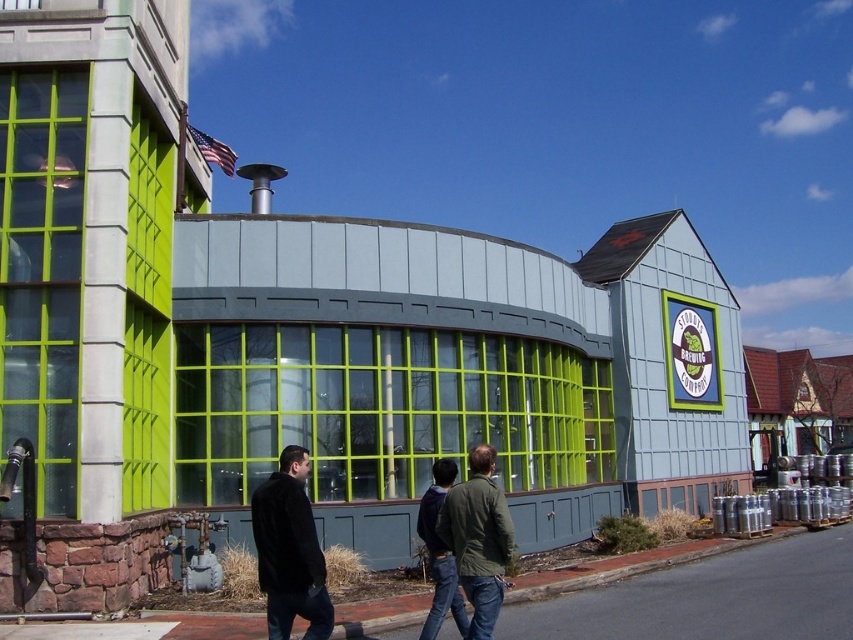
Question: Can you confirm if green fabric jacket at center is positioned to the left of black fuzzy coat at center?

Choices:
 (A) no
 (B) yes

Answer: (A)

Question: Which point is closer to the camera taking this photo?

Choices:
 (A) (286, 616)
 (B) (512, 598)

Answer: (A)

Question: Does green fabric jacket at center have a smaller size compared to black fuzzy coat at center?

Choices:
 (A) no
 (B) yes

Answer: (A)

Question: Does smooth asphalt road at lower center appear on the right side of black fuzzy coat at center?

Choices:
 (A) no
 (B) yes

Answer: (B)

Question: Which point is closer to the camera?

Choices:
 (A) (849, 570)
 (B) (318, 589)

Answer: (B)

Question: Estimate the real-world distances between objects in this image. Which object is farther from the green fabric jacket at center?

Choices:
 (A) smooth asphalt road at lower center
 (B) black fuzzy coat at center

Answer: (A)